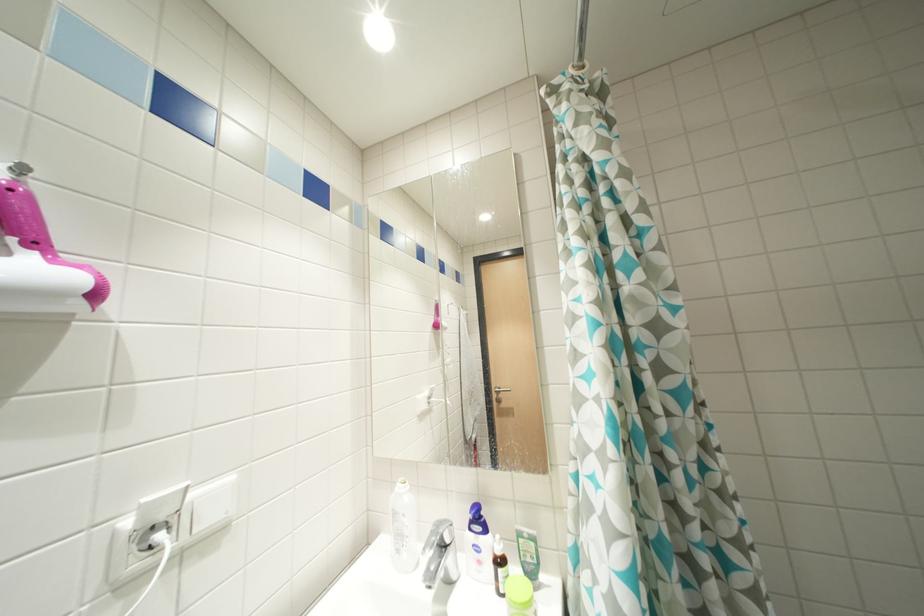
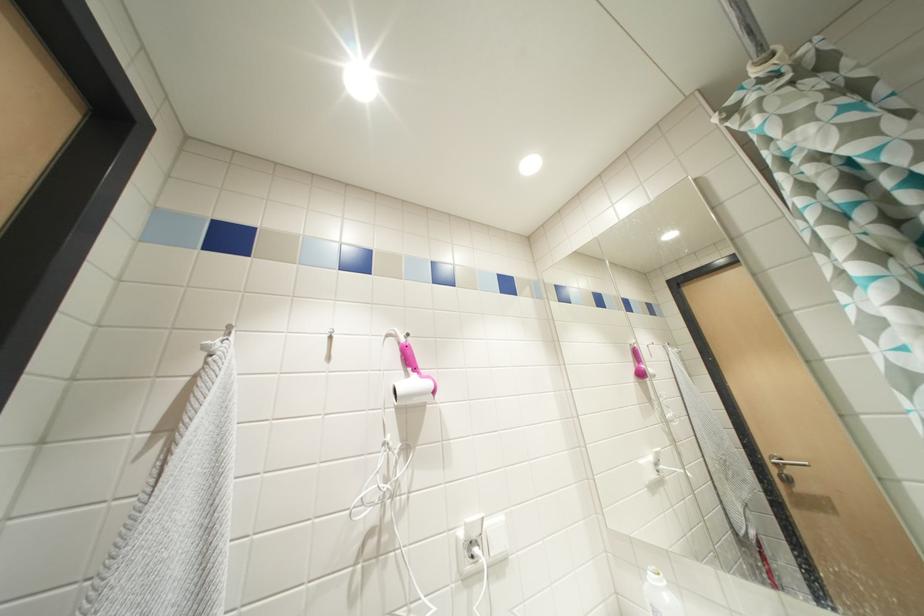
Question: The camera is either moving clockwise (left) or counter-clockwise (right) around the object. The first image is from the beginning of the video and the second image is from the end. Is the camera moving left or right when shooting the video?

Choices:
 (A) Left
 (B) Right

Answer: (B)